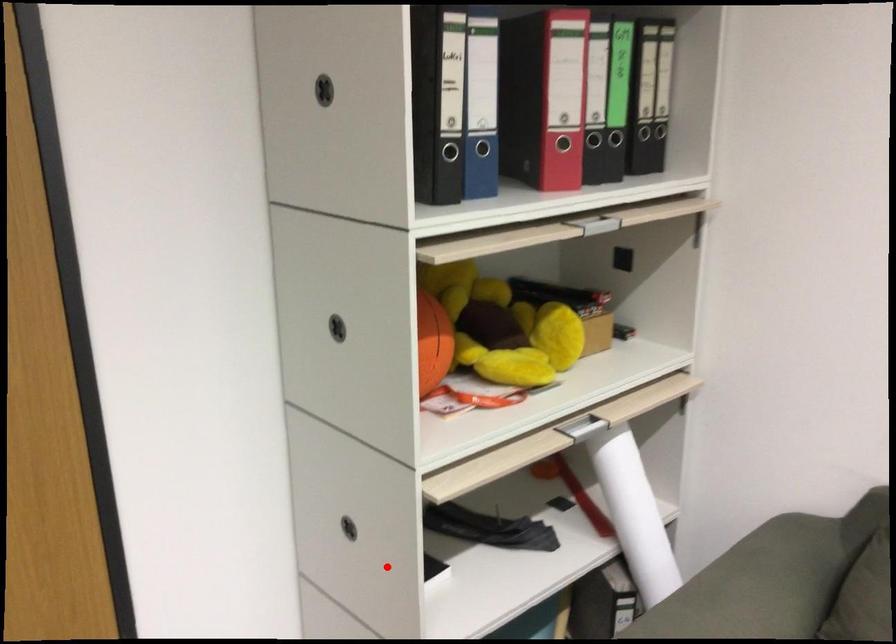
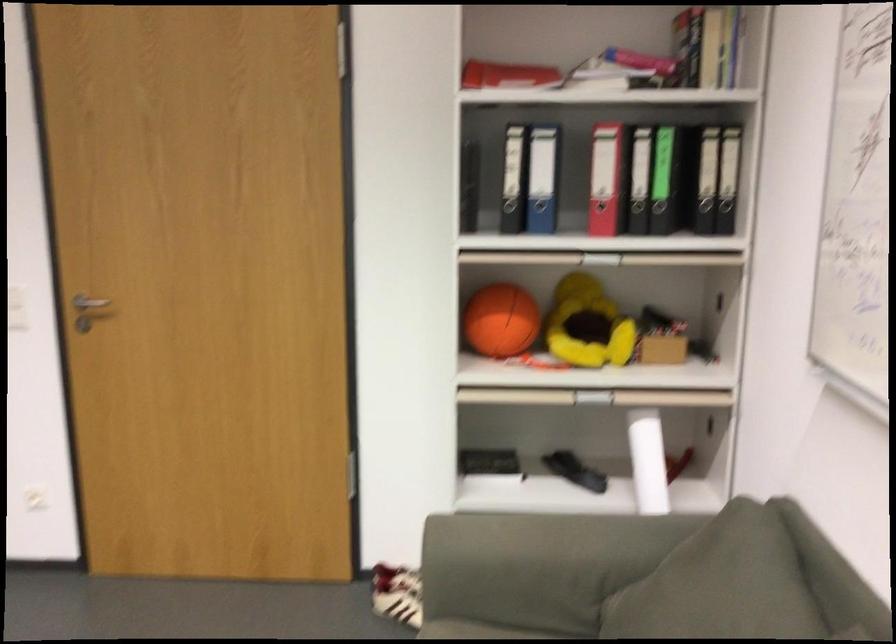
Question: I am providing you with two images of the same scene from different viewpoints. Image1 has a red point marked. In image2, the corresponding 3D location appears at what relative position? Reply with the corresponding letter.

Choices:
 (A) Closer
 (B) Farther

Answer: (B)